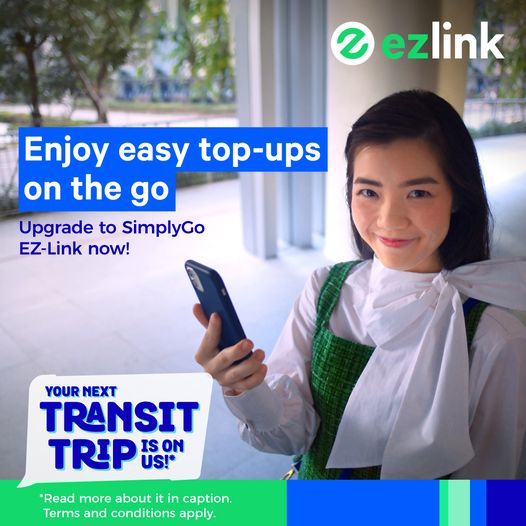
Locate an element on the screen. The height and width of the screenshot is (526, 526). dress is located at coordinates (319, 396).